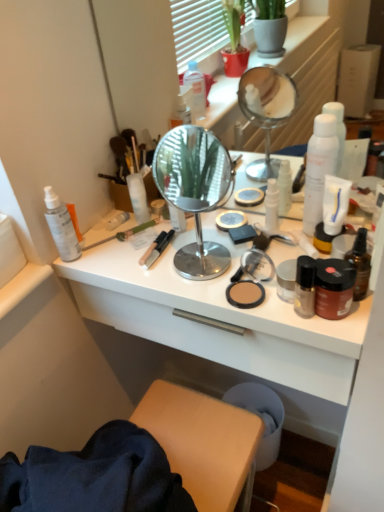
The height and width of the screenshot is (512, 384). What are the coordinates of `free space between translucent plastic spray bottle at left, which is the eighth toiletry in right-to-left order, and matte gold jar at center right, which ranks as the eighth toiletry in left-to-right order` in the screenshot? It's located at (167, 252).